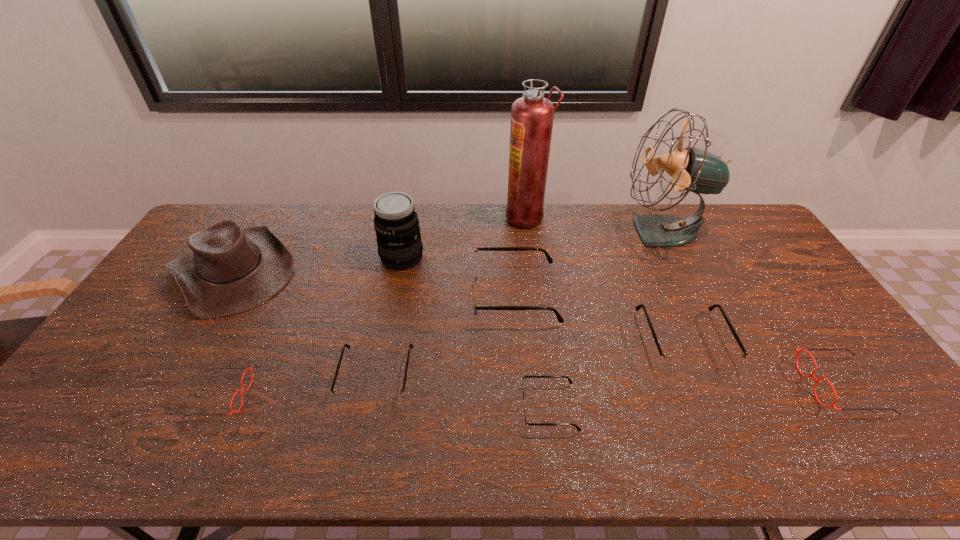
Image resolution: width=960 pixels, height=540 pixels. I want to click on free space between the smallest black spectacles and the second spectacles from right to left, so click(x=616, y=375).

Where is `vacant space in between the fan and the biggest black spectacles`? This screenshot has height=540, width=960. vacant space in between the fan and the biggest black spectacles is located at coordinates (588, 263).

You are a GUI agent. You are given a task and a screenshot of the screen. Output one action in this format:
    pyautogui.click(x=<x>, y=<y>)
    Task: Click on the free area in between the rightmost black spectacles and the fan
    
    Given the screenshot: What is the action you would take?
    pyautogui.click(x=673, y=286)

Locate an element on the screen. free space between the leftmost spectacles and the right red spectacles is located at coordinates (531, 391).

At what (x,y) coordinates should I click in order to perform the action: click on free space between the blue fan and the fifth spectacles from left to right. Please return your answer as a coordinate pair (x, y). The image size is (960, 540). Looking at the image, I should click on (673, 286).

I want to click on the fifth closest object to the second spectacles from right to left, so click(532, 115).

Where is `object that is the fourth closest to the blue fan`? object that is the fourth closest to the blue fan is located at coordinates (833, 405).

This screenshot has height=540, width=960. What are the coordinates of `spectacles identified as the fourth closest to the rightmost object` in the screenshot? It's located at (388, 397).

Select which spectacles appears as the fifth closest to the blue fan. Please provide its 2D coordinates. Your answer should be formatted as a tuple, i.e. [(x, y)], where the tuple contains the x and y coordinates of a point satisfying the conditions above.

[(388, 397)]

The width and height of the screenshot is (960, 540). What are the coordinates of `black spectacles that is the nearest to the third tallest object` in the screenshot? It's located at (474, 266).